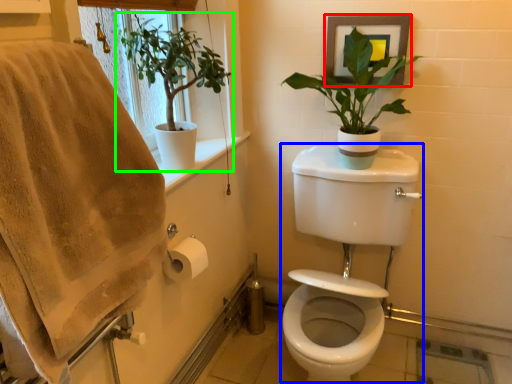
Question: Based on their relative distances, which object is nearer to picture frame (highlighted by a red box)? Choose from sink (highlighted by a blue box) and houseplant (highlighted by a green box).

Choices:
 (A) sink
 (B) houseplant

Answer: (A)